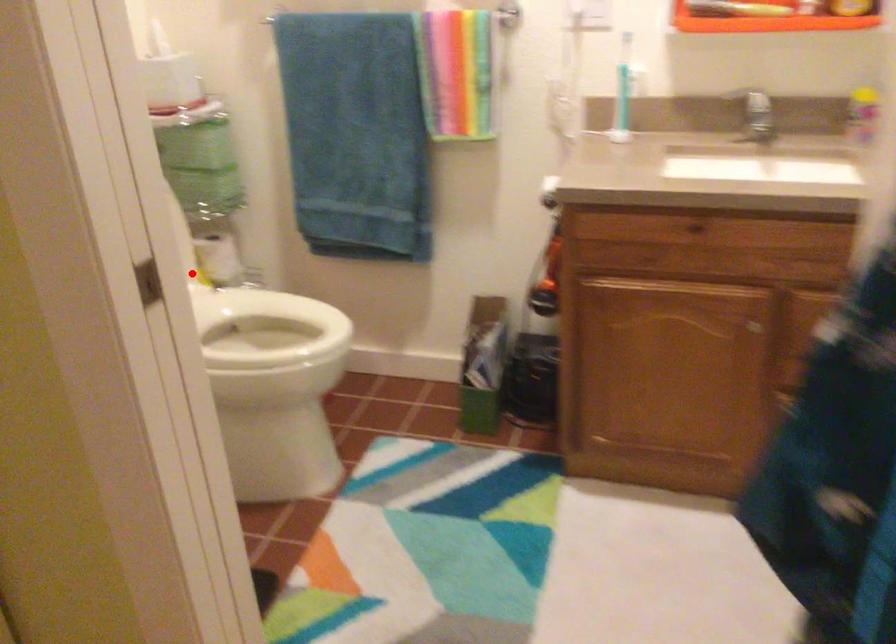
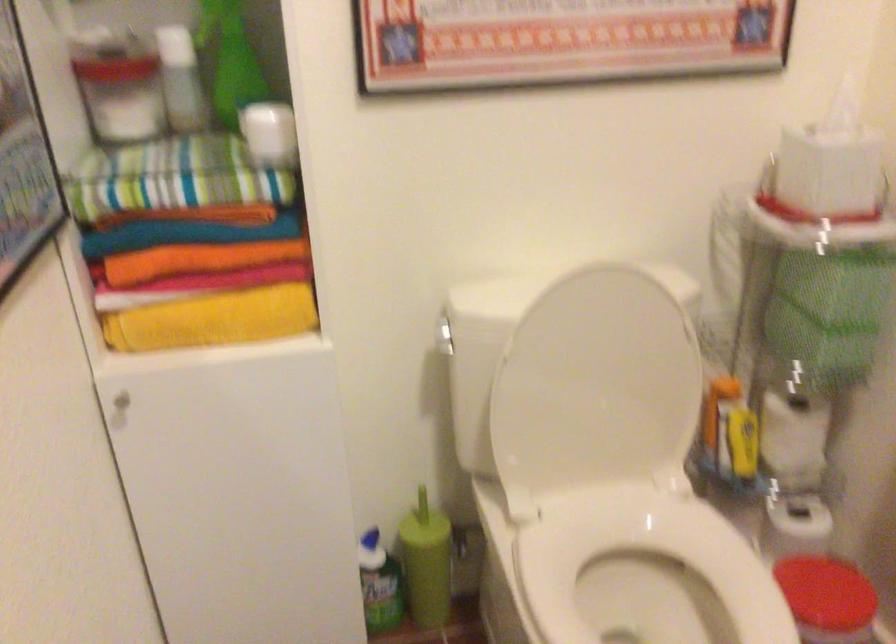
Question: I am providing you with two images of the same scene from different viewpoints. In image1, a red point is highlighted. Considering the same 3D point in image2, which of the following is correct?

Choices:
 (A) It is closer
 (B) It is farther

Answer: (A)